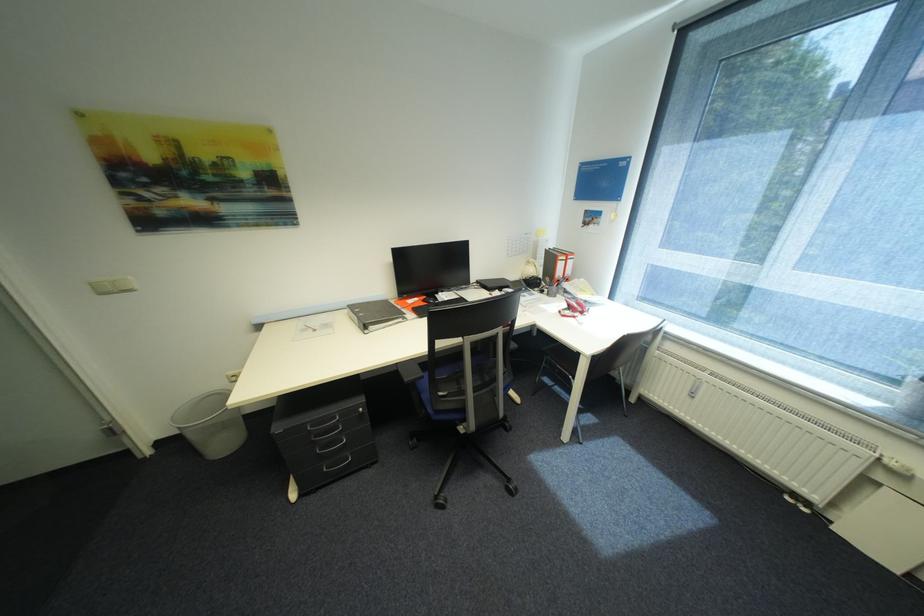
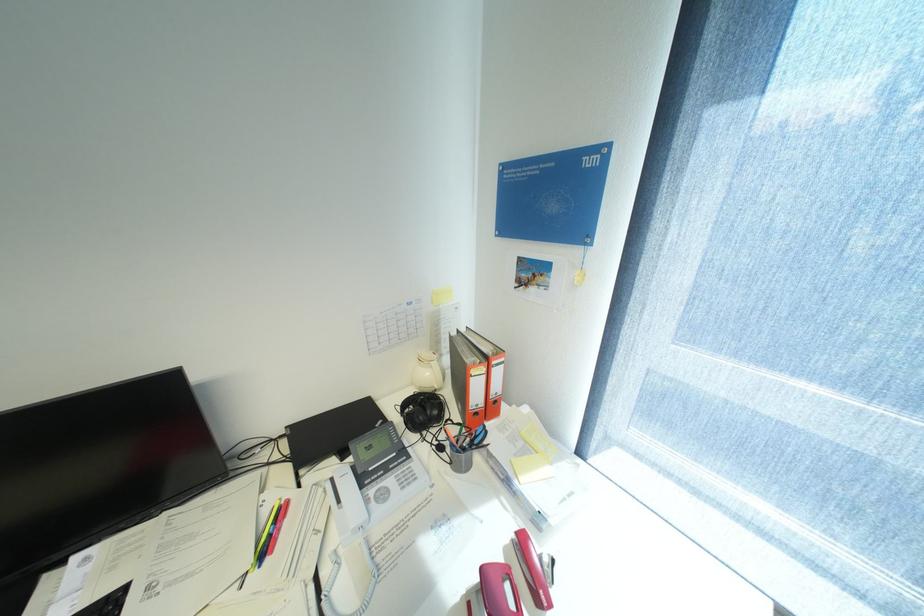
The images are taken continuously from a first-person perspective. In which direction are you moving?

The cameraman walked toward right, forward.